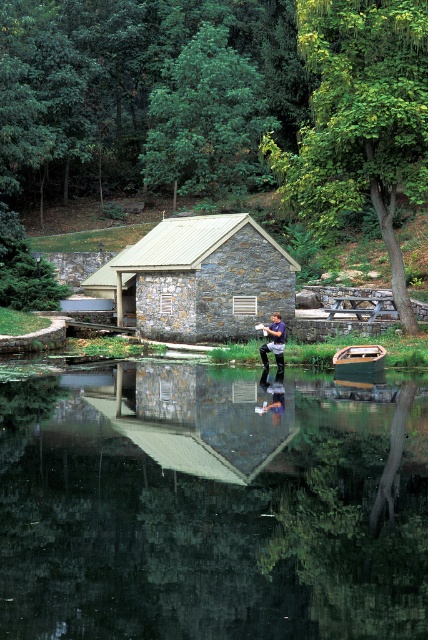
In the scene shown: Does smooth reflective water at center have a lesser width compared to dark blue shirt at center?

No.

Does smooth reflective water at center come in front of dark blue shirt at center?

Yes, it is.

In order to click on smooth reflective water at center in this screenshot , I will do `click(211, 506)`.

Can you confirm if stone/rough hut at center is positioned above dark blue shirt at center?

Yes, stone/rough hut at center is above dark blue shirt at center.

Is stone/rough hut at center below dark blue shirt at center?

No, stone/rough hut at center is not below dark blue shirt at center.

Which is in front, point (181, 291) or point (267, 330)?

Point (267, 330) is more forward.

Find the location of a particular element. The height and width of the screenshot is (640, 428). stone/rough hut at center is located at coordinates (205, 276).

Does smooth reflective water at center appear on the left side of stone/rough hut at center?

Incorrect, smooth reflective water at center is not on the left side of stone/rough hut at center.

At what (x,y) coordinates should I click in order to perform the action: click on smooth reflective water at center. Please return your answer as a coordinate pair (x, y). Looking at the image, I should click on (211, 506).